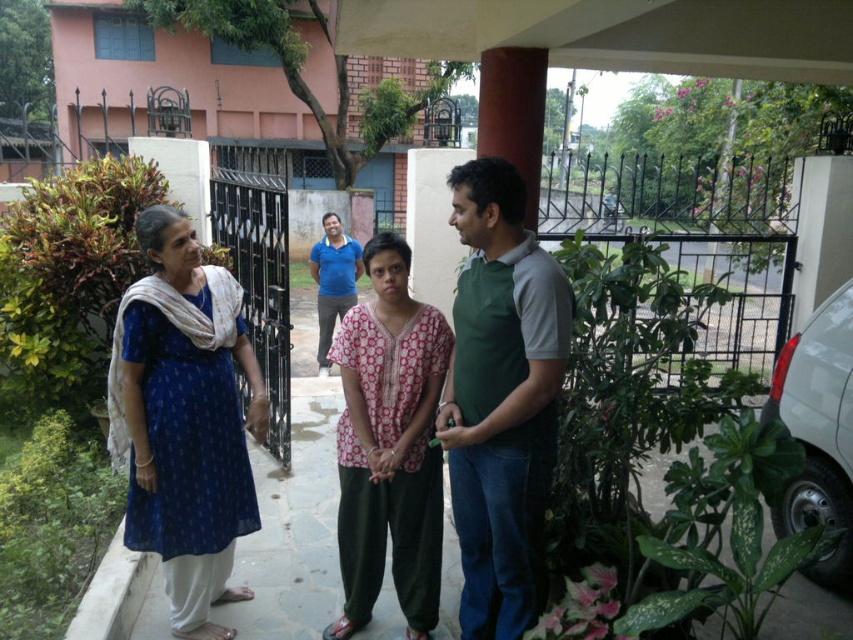
You are a photographer setting up a tripod in the courtyard. You want to take a photo that includes both the green cotton shirt at center and the blue cotton kurta at left. Which person should be closer to the camera to ensure both are fully visible in the frame?

The green cotton shirt at center is in front of the blue cotton kurta at left, so the person wearing the blue cotton kurta at left should be moved closer to the camera to ensure both are fully visible in the frame.

You are planning to place a bench between the blue cotton kurta at left and the blue cotton shirt at center. Given that the bench requires 12 feet of space, will there be enough room?

The blue cotton kurta at left and blue cotton shirt at center are 14.10 feet apart, so yes, there is enough space to place the bench between them since 14.10 feet is greater than the required 12 feet.

You are a photographer trying to capture the blue printed dress at left and the blue cotton kurta at left in a single shot. Which one of these two items will appear larger in your photo?

The blue printed dress at left will appear larger in the photo because it is closer to the viewer than the blue cotton kurta at left.